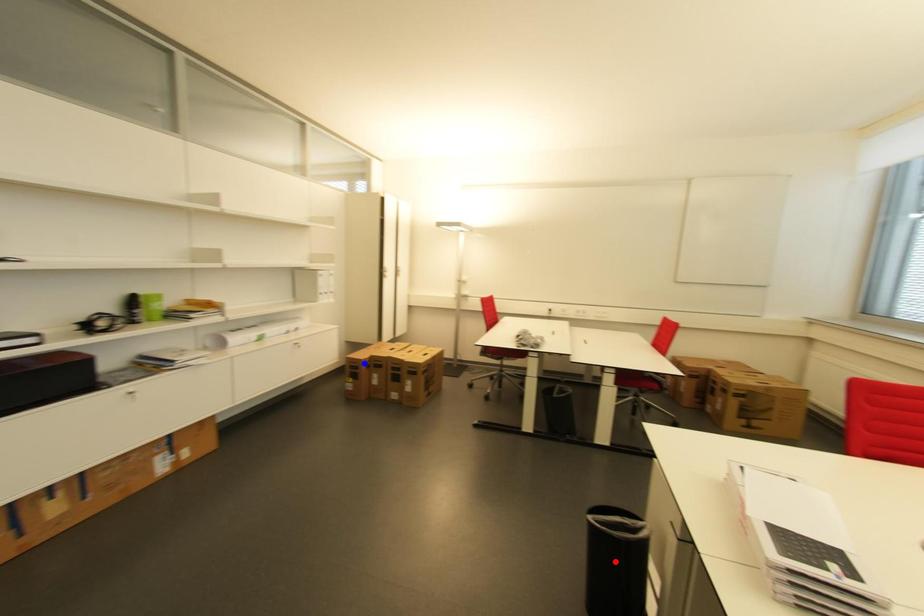
Question: Which of the two points in the image is closer to the camera?

Choices:
 (A) Blue point is closer.
 (B) Red point is closer.

Answer: (B)